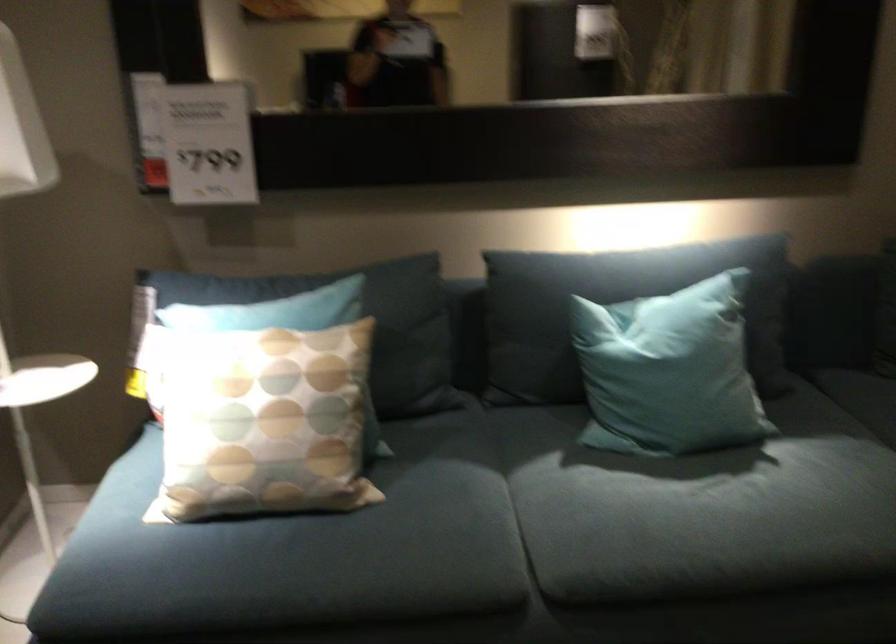
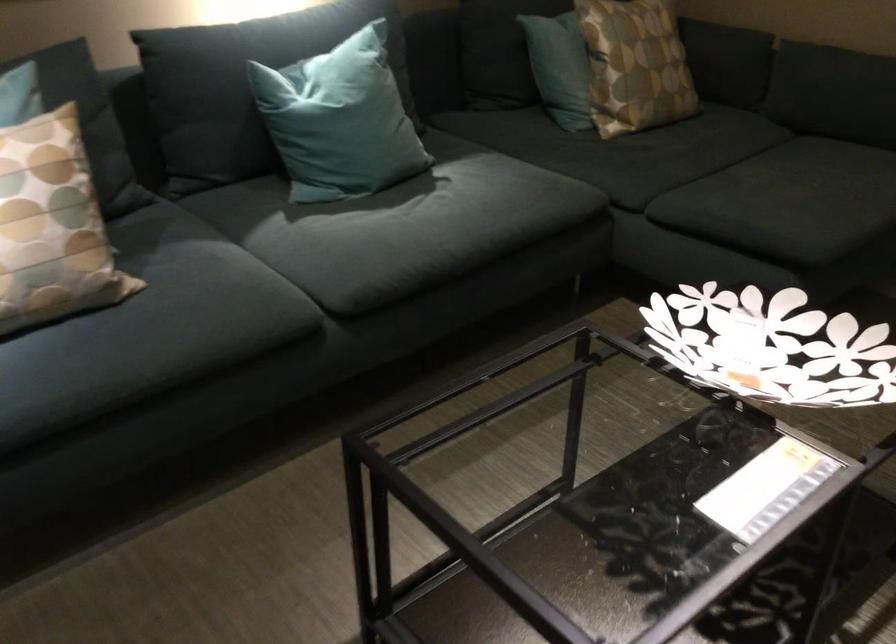
Question: The camera is either moving clockwise (left) or counter-clockwise (right) around the object. The first image is from the beginning of the video and the second image is from the end. Is the camera moving left or right when shooting the video?

Choices:
 (A) Left
 (B) Right

Answer: (A)